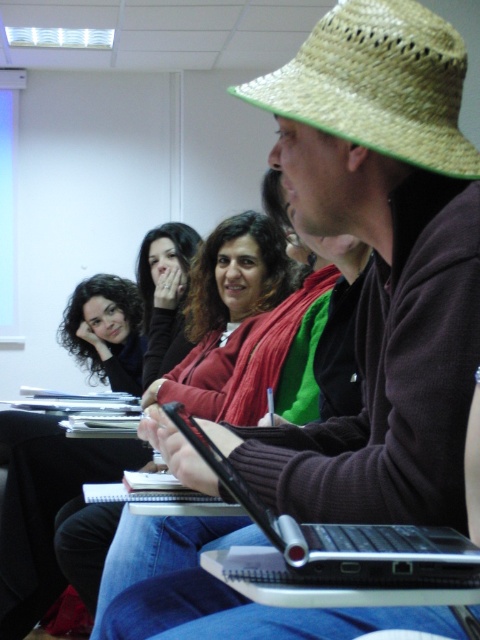
Does matte red sweater at center have a greater height compared to black plastic laptop at center?

Yes, matte red sweater at center is taller than black plastic laptop at center.

Looking at this image, who is taller, matte red sweater at center or black plastic laptop at center?

matte red sweater at center

Is point (199, 268) positioned in front of point (466, 579)?

No, it is not.

Identify the location of matte red sweater at center. The image size is (480, 640). (226, 307).

Looking at this image, is matte red sweater at center to the left of matte black hair at upper center from the viewer's perspective?

Incorrect, matte red sweater at center is not on the left side of matte black hair at upper center.

Find the location of `matte red sweater at center`. matte red sweater at center is located at coordinates (226, 307).

Locate an element on the screen. The height and width of the screenshot is (640, 480). strawhat at upper right is located at coordinates (377, 83).

Where is `strawhat at upper right`? strawhat at upper right is located at coordinates (377, 83).